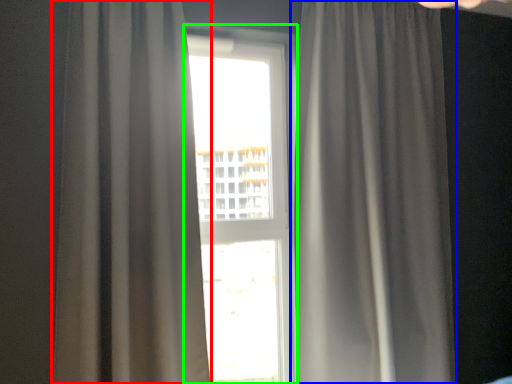
Question: Which is nearer to the curtain (highlighted by a red box)? curtain (highlighted by a blue box) or window (highlighted by a green box).

Choices:
 (A) curtain
 (B) window

Answer: (A)